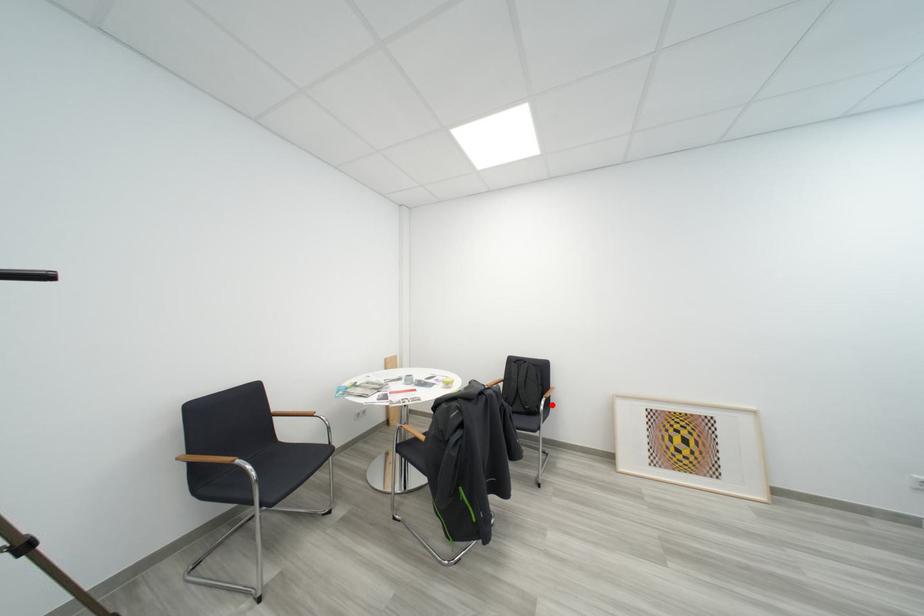
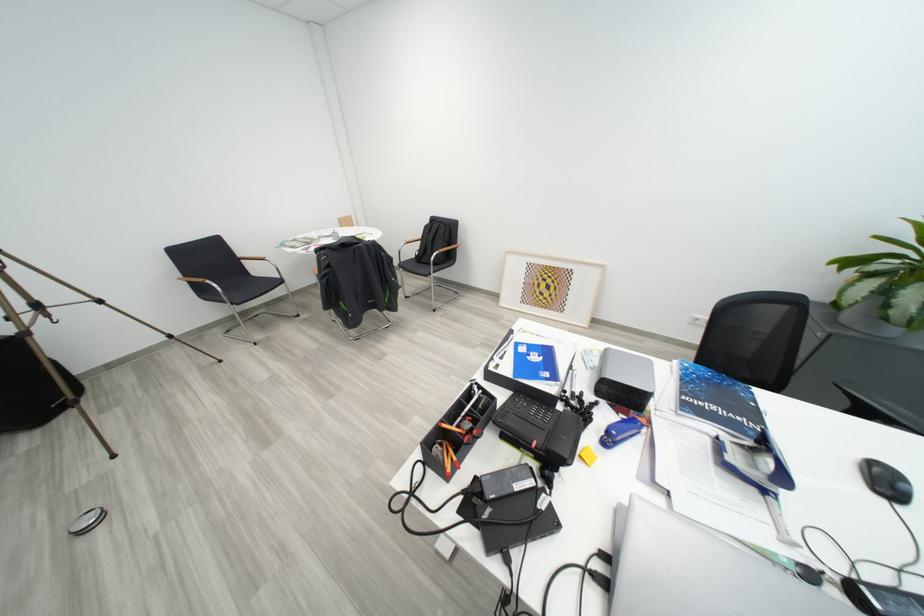
Question: A red point is marked in image1. In image2, is the corresponding 3D point closer to the camera or farther? Reply with the corresponding letter.

Choices:
 (A) The corresponding 3D point is closer.
 (B) The corresponding 3D point is farther.

Answer: (A)